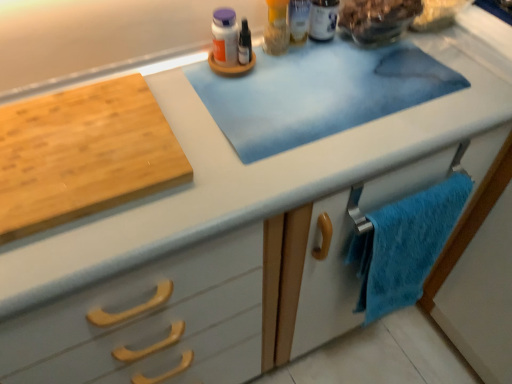
Identify the location of empty space that is to the right of translucent plastic container at upper center, arranged as the 2th toiletry when viewed from the right. (362, 62).